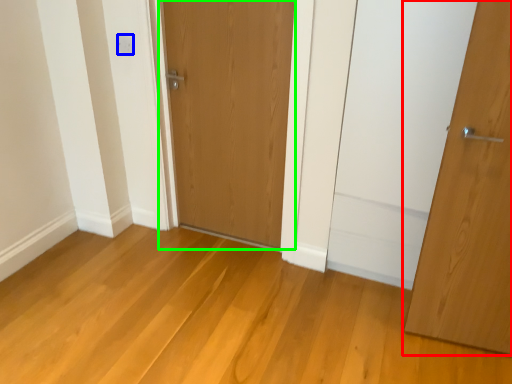
Question: Which object is positioned farthest from door (highlighted by a red box)? Select from electric outlet (highlighted by a blue box) and door (highlighted by a green box).

Choices:
 (A) electric outlet
 (B) door

Answer: (A)